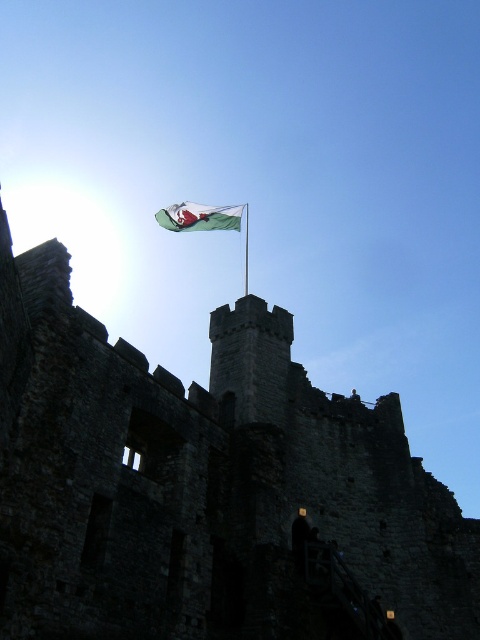
Is green fabric flag at upper center bigger than green fabric flagpole at upper center?

Correct, green fabric flag at upper center is larger in size than green fabric flagpole at upper center.

Based on the photo, does green fabric flag at upper center appear on the right side of green fabric flagpole at upper center?

Incorrect, green fabric flag at upper center is not on the right side of green fabric flagpole at upper center.

Which is in front, point (181, 225) or point (247, 292)?

Point (247, 292) is in front.

Locate an element on the screen. green fabric flag at upper center is located at coordinates (200, 216).

Between dark stone castle at upper center and green fabric flagpole at upper center, which one appears on the left side from the viewer's perspective?

Positioned to the left is green fabric flagpole at upper center.

Does dark stone castle at upper center have a lesser height compared to green fabric flagpole at upper center?

No.

Which is in front, point (9, 451) or point (247, 275)?

Point (9, 451) is in front.

You are a GUI agent. You are given a task and a screenshot of the screen. Output one action in this format:
    pyautogui.click(x=<x>, y=<y>)
    Task: Click on the dark stone castle at upper center
    The width and height of the screenshot is (480, 640).
    Given the screenshot: What is the action you would take?
    pyautogui.click(x=206, y=486)

Between point (431, 628) and point (164, 227), which one is positioned in front?

Positioned in front is point (431, 628).

Is dark stone castle at upper center bigger than green fabric flag at upper center?

Indeed, dark stone castle at upper center has a larger size compared to green fabric flag at upper center.

Which is in front, point (343, 593) or point (180, 218)?

Point (343, 593) is in front.

Locate an element on the screen. The width and height of the screenshot is (480, 640). dark stone castle at upper center is located at coordinates (206, 486).